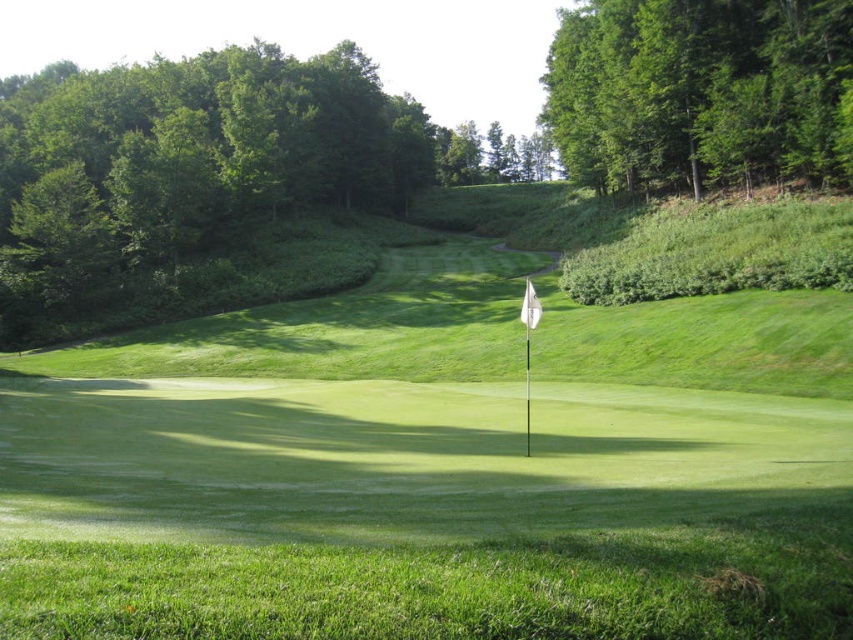
Question: Which point appears closest to the camera in this image?

Choices:
 (A) (755, 65)
 (B) (796, 328)

Answer: (B)

Question: Is green grass flag at center further to the viewer compared to green leafy tree at upper right?

Choices:
 (A) no
 (B) yes

Answer: (A)

Question: Can you confirm if green grass flag at center is thinner than green leafy tree at upper right?

Choices:
 (A) yes
 (B) no

Answer: (B)

Question: Which of the following is the farthest from the observer?

Choices:
 (A) (635, 6)
 (B) (549, 506)

Answer: (A)

Question: Is green grass flag at center positioned before green leafy tree at upper right?

Choices:
 (A) no
 (B) yes

Answer: (B)